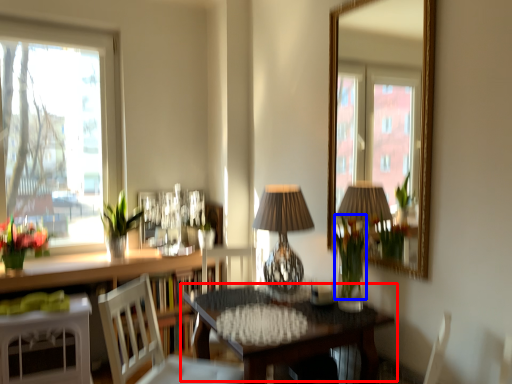
Question: Which point is further to the camera, table (highlighted by a red box) or flower (highlighted by a blue box)?

Choices:
 (A) table
 (B) flower

Answer: (B)